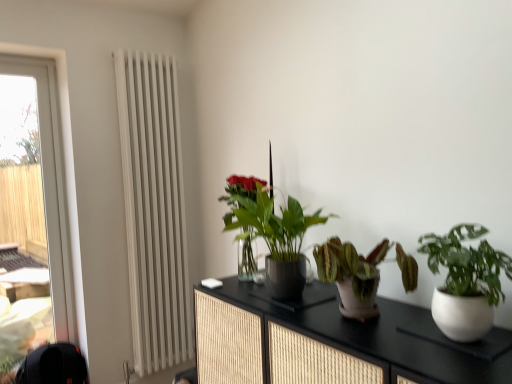
Image resolution: width=512 pixels, height=384 pixels. I want to click on vacant region under green matte plant at center, the third houseplant viewed from the front (from a real-world perspective), so click(264, 299).